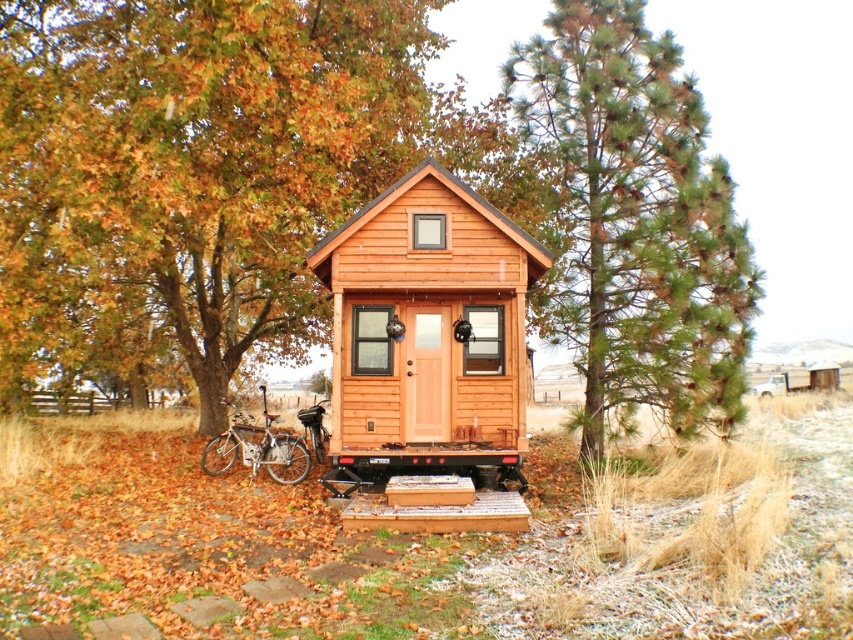
Question: Does green pine tree at right have a lesser width compared to silver metallic bicycle at lower left?

Choices:
 (A) no
 (B) yes

Answer: (A)

Question: Which of the following is the farthest from the observer?

Choices:
 (A) [x=155, y=225]
 (B) [x=265, y=433]
 (C) [x=796, y=397]
 (D) [x=668, y=76]

Answer: (C)

Question: Is wooden platform at center above green leafy tree at left?

Choices:
 (A) yes
 (B) no

Answer: (B)

Question: Which point is farther to the camera?

Choices:
 (A) (659, 228)
 (B) (134, 605)
 (C) (305, 246)
 (D) (299, 481)

Answer: (C)

Question: Is wooden platform at center closer to the viewer compared to silver metallic bicycle at lower left?

Choices:
 (A) no
 (B) yes

Answer: (B)

Question: Estimate the real-world distances between objects in this image. Which object is closer to the silver metallic bicycle at lower left?

Choices:
 (A) wooden cabin at center
 (B) wooden platform at center
 (C) green leafy tree at left
 (D) green pine tree at right

Answer: (A)